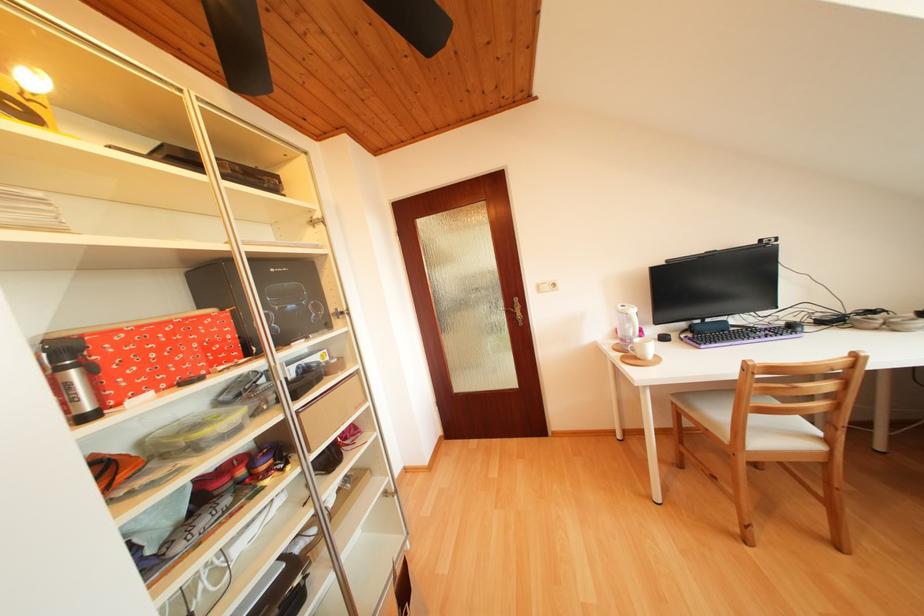
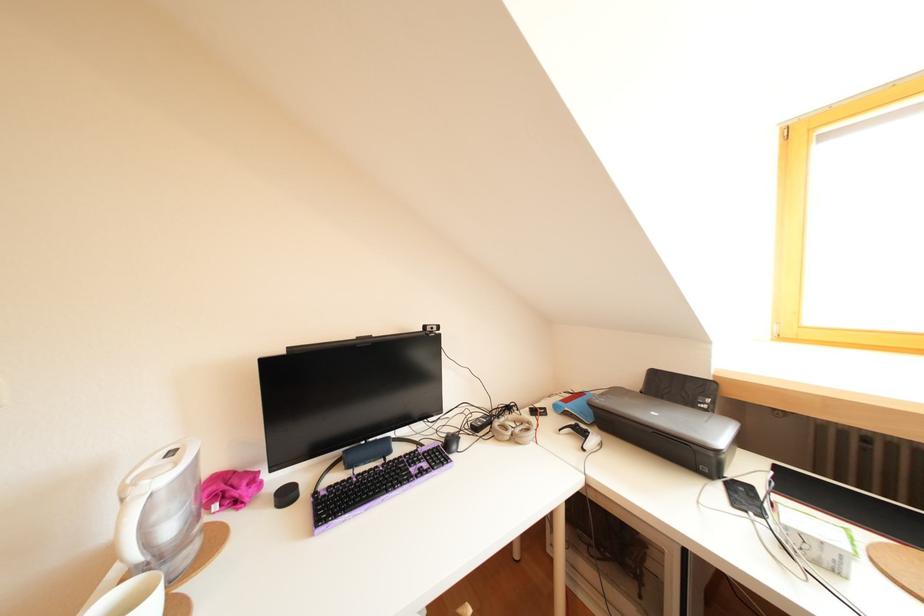
Find the pixel in the second image that matches (x=880, y=317) in the first image.

(516, 413)